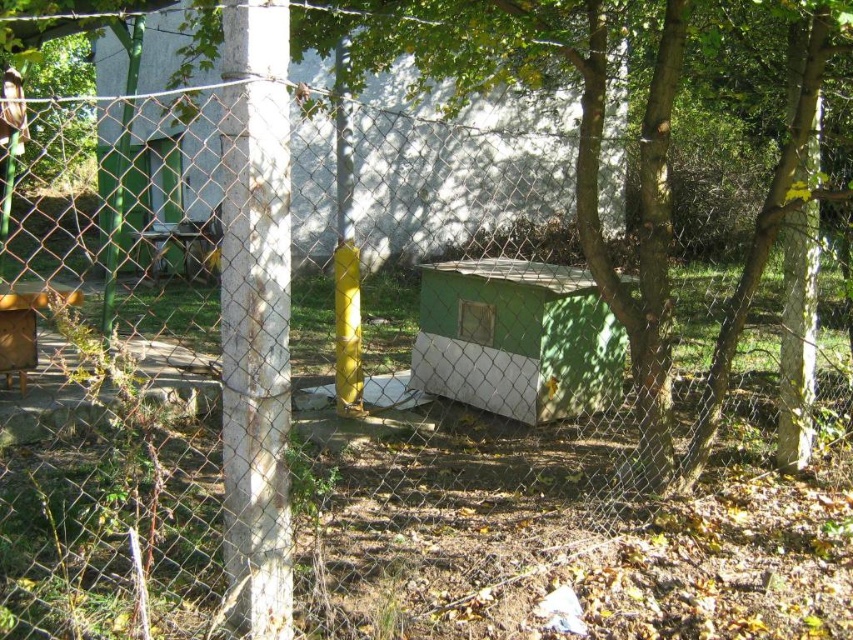
You are standing at the entrance of the fenced area and want to locate the white concrete pole at center. According to the coordinates provided, where should you look relative to your position?

The white concrete pole at center is located at coordinates point (254, 316), which places it near the center of the area. Since you are at the entrance, you should look straight ahead towards the middle of the fenced area to find it.